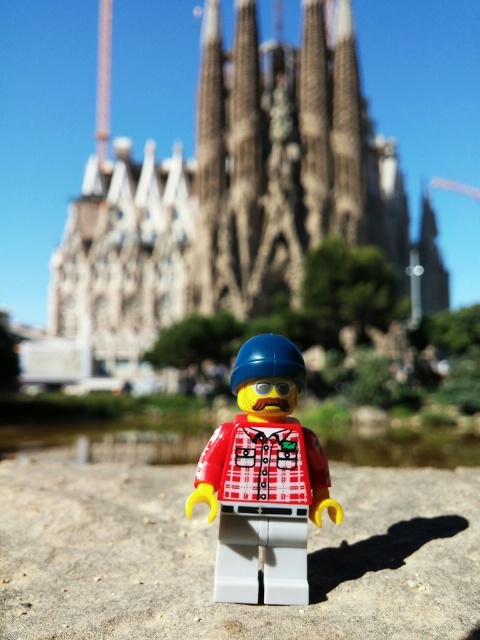
Question: Is gray stone sand at center closer to the viewer compared to plaid fabric minifigure at center?

Choices:
 (A) no
 (B) yes

Answer: (B)

Question: Can you confirm if gray stone sand at center is bigger than plaid fabric minifigure at center?

Choices:
 (A) yes
 (B) no

Answer: (A)

Question: Which of the following is the farthest from the observer?

Choices:
 (A) plaid fabric minifigure at center
 (B) gray stone sand at center

Answer: (A)

Question: Which point is closer to the camera taking this photo?

Choices:
 (A) (265, 534)
 (B) (167, 513)

Answer: (A)

Question: Is gray stone sand at center to the left of plaid fabric minifigure at center from the viewer's perspective?

Choices:
 (A) yes
 (B) no

Answer: (A)